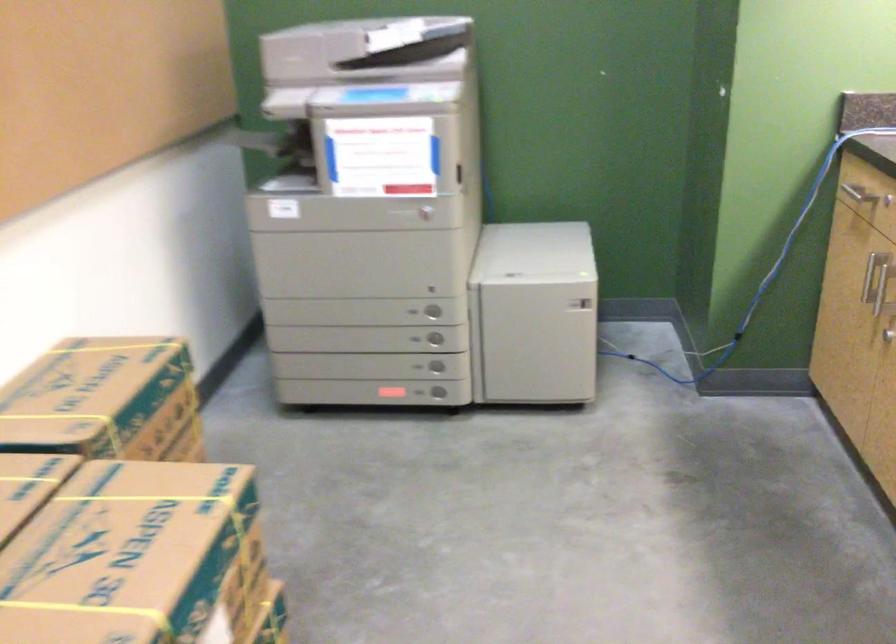
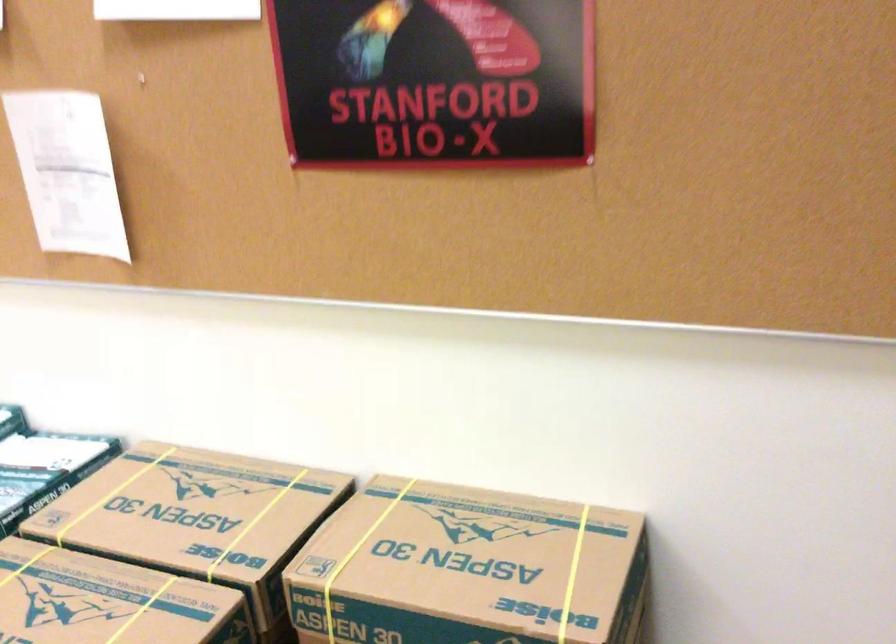
Where in the second image is the point corresponding to (x=109, y=498) from the first image?

(142, 609)